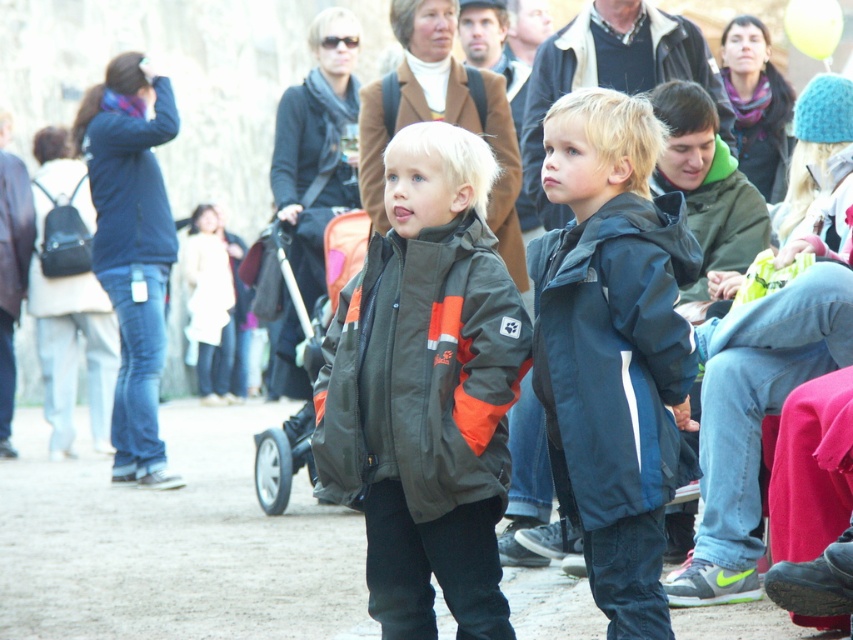
Question: Which is nearer to the green fleece jacket at upper right?

Choices:
 (A) dark gray fleece jacket at center
 (B) dark blue waterproof jacket at center

Answer: (B)

Question: Does dark blue nylon jacket at center appear on the right side of green fleece jacket at upper right?

Choices:
 (A) no
 (B) yes

Answer: (A)

Question: Which point is farther to the camera?

Choices:
 (A) dark blue waterproof jacket at center
 (B) dark gray jacket at center

Answer: (B)

Question: Which of these objects is positioned farthest from the dark blue nylon jacket at center?

Choices:
 (A) dark blue waterproof jacket at center
 (B) orange fabric baby carriage at center
 (C) dark gray fleece jacket at center
 (D) dark gray jacket at center

Answer: (C)

Question: Does orange fabric baby carriage at center have a greater width compared to green fleece jacket at upper right?

Choices:
 (A) yes
 (B) no

Answer: (B)

Question: Is dark blue waterproof jacket at center further to the viewer compared to orange fabric baby carriage at center?

Choices:
 (A) no
 (B) yes

Answer: (A)